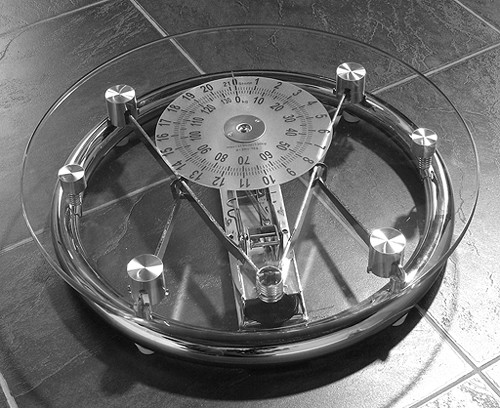
Locate an element on the screen. grout is located at coordinates [469, 366], [492, 360], [25, 238], [160, 27].